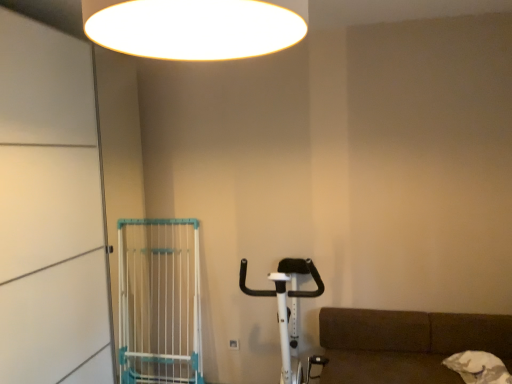
Question: Looking at their shapes, would you say white fabric bag at lower right is wider or thinner than white plastic gate at left?

Choices:
 (A) thin
 (B) wide

Answer: (B)

Question: Is white fabric bag at lower right to the left or to the right of white plastic gate at left in the image?

Choices:
 (A) right
 (B) left

Answer: (A)

Question: Which is nearer to the white plastic baby carriage at center-right?

Choices:
 (A) white plastic screen door at left
 (B) white plastic gate at left
 (C) white fabric bag at lower right
 (D) white glossy ceiling light at upper center

Answer: (B)

Question: Which object is positioned closest to the white plastic baby carriage at center-right?

Choices:
 (A) white fabric bag at lower right
 (B) white plastic screen door at left
 (C) white plastic gate at left
 (D) white glossy ceiling light at upper center

Answer: (C)